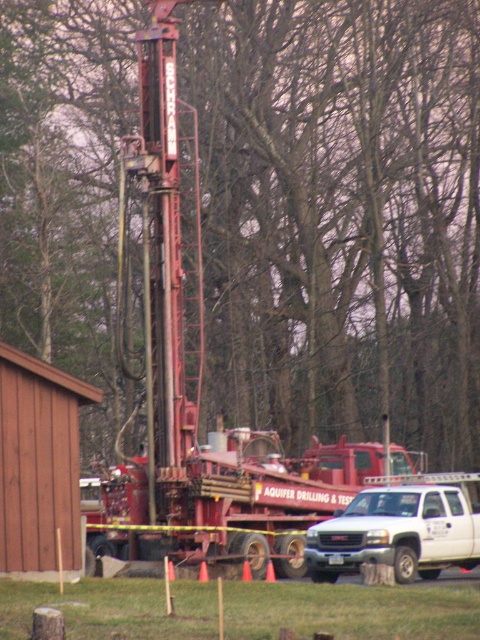
Question: Which object is farther from the camera taking this photo?

Choices:
 (A) bare branches at center
 (B) white matte truck at lower right

Answer: (A)

Question: Where is bare branches at center located in relation to white matte truck at lower right in the image?

Choices:
 (A) above
 (B) below

Answer: (A)

Question: Can you confirm if bare branches at center is positioned to the left of white matte truck at lower right?

Choices:
 (A) yes
 (B) no

Answer: (A)

Question: Which point appears farthest from the camera in this image?

Choices:
 (A) (423, 157)
 (B) (325, 563)

Answer: (A)

Question: Does bare branches at center appear on the left side of white matte truck at lower right?

Choices:
 (A) no
 (B) yes

Answer: (B)